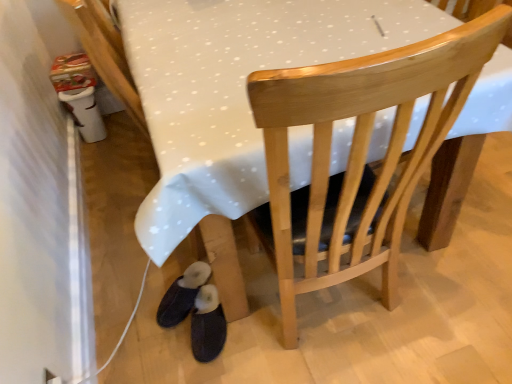
I want to click on vacant space to the right of dark blue fabric slippers at lower left, marked as the 1th footwear in a right-to-left arrangement, so click(x=262, y=321).